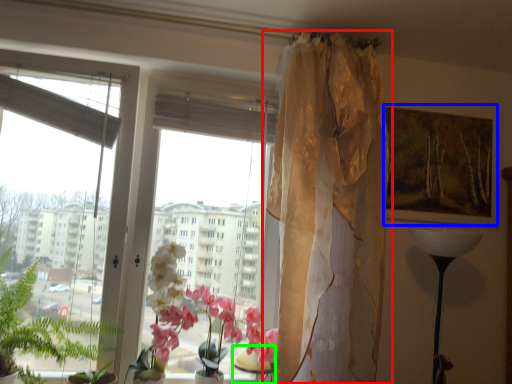
Question: Which is nearer to the curtain (highlighted by a red box)? picture frame (highlighted by a blue box) or table (highlighted by a green box).

Choices:
 (A) picture frame
 (B) table

Answer: (A)